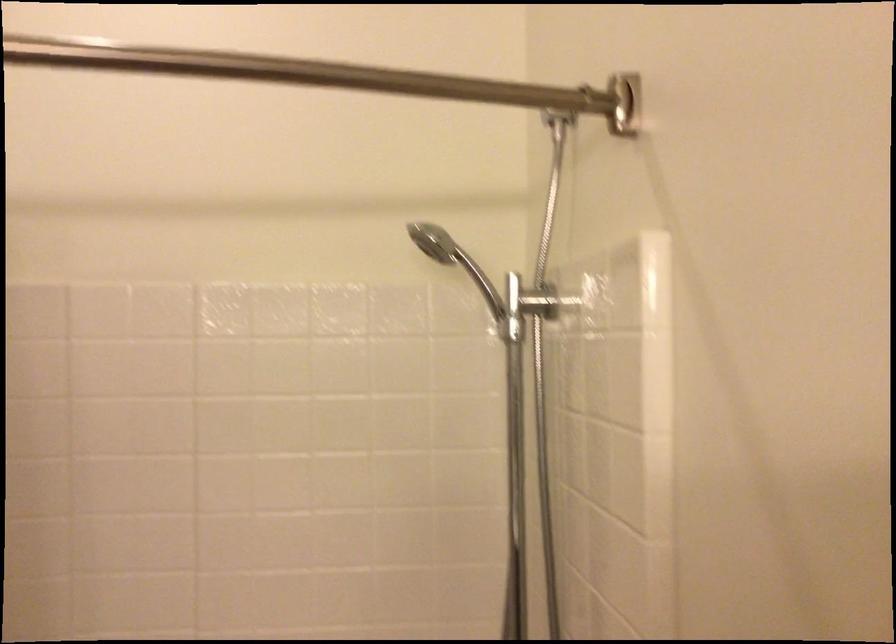
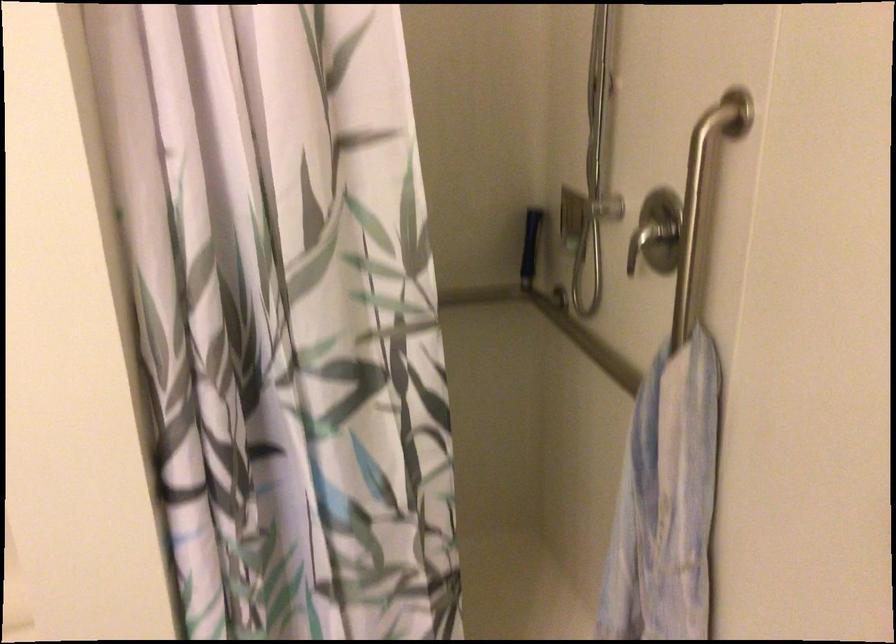
Question: How did the camera likely rotate?

Choices:
 (A) Left
 (B) Right
 (C) Up
 (D) Down

Answer: (D)